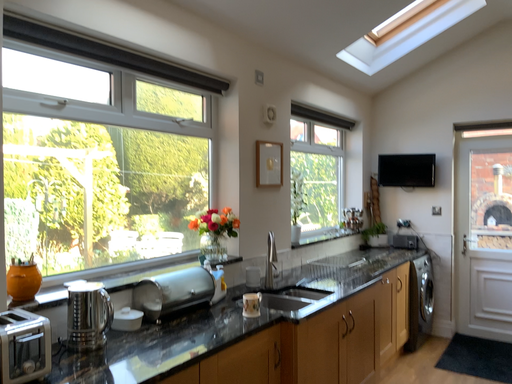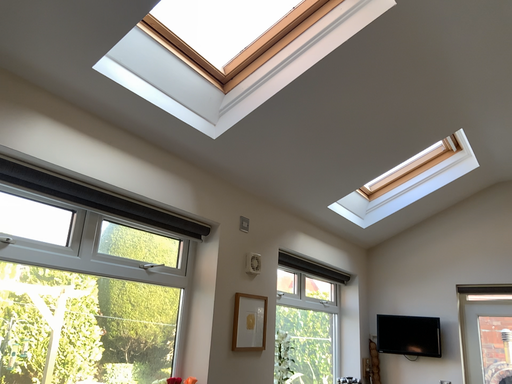
Question: How did the camera likely rotate when shooting the video?

Choices:
 (A) rotated downward
 (B) rotated upward

Answer: (B)